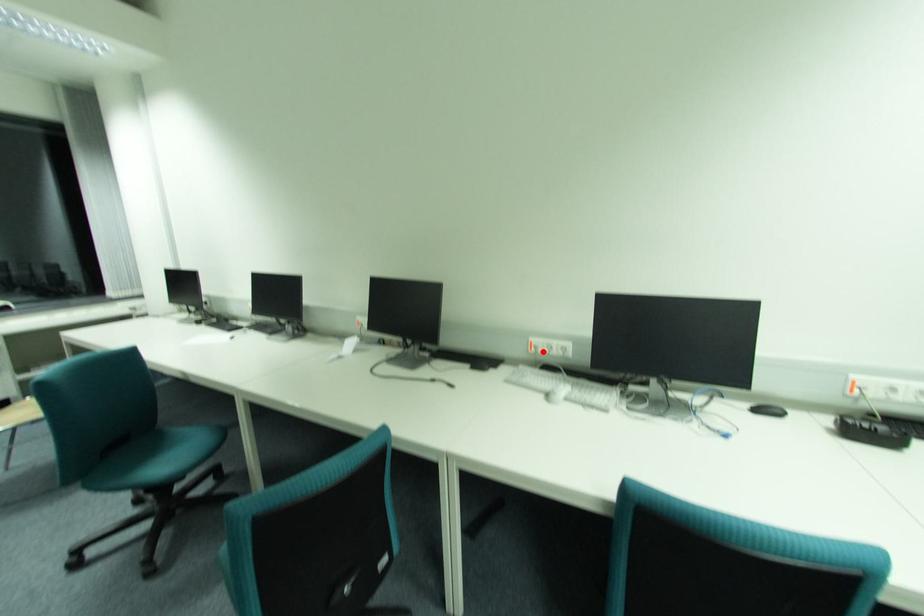
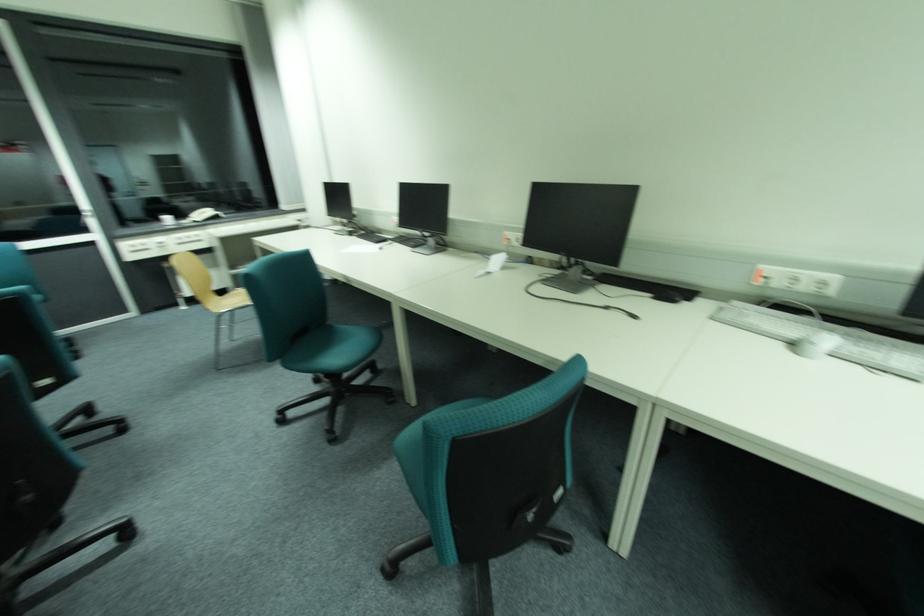
The point at the highlighted location is marked in the first image. Where is the corresponding point in the second image?

(772, 283)